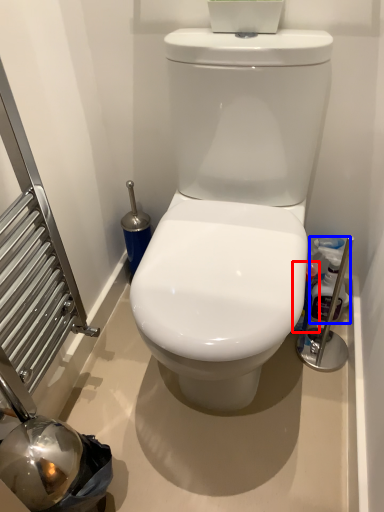
Question: Which object appears farthest to the camera in this image, cleaning product (highlighted by a red box) or cleaning product (highlighted by a blue box)?

Choices:
 (A) cleaning product
 (B) cleaning product

Answer: (A)